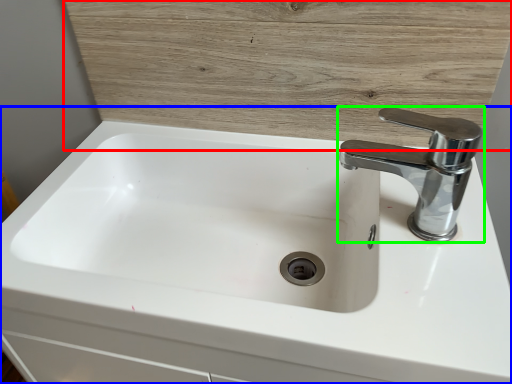
Question: Based on their relative distances, which object is farther from wood (highlighted by a red box)? Choose from sink (highlighted by a blue box) and tap (highlighted by a green box).

Choices:
 (A) sink
 (B) tap

Answer: (A)